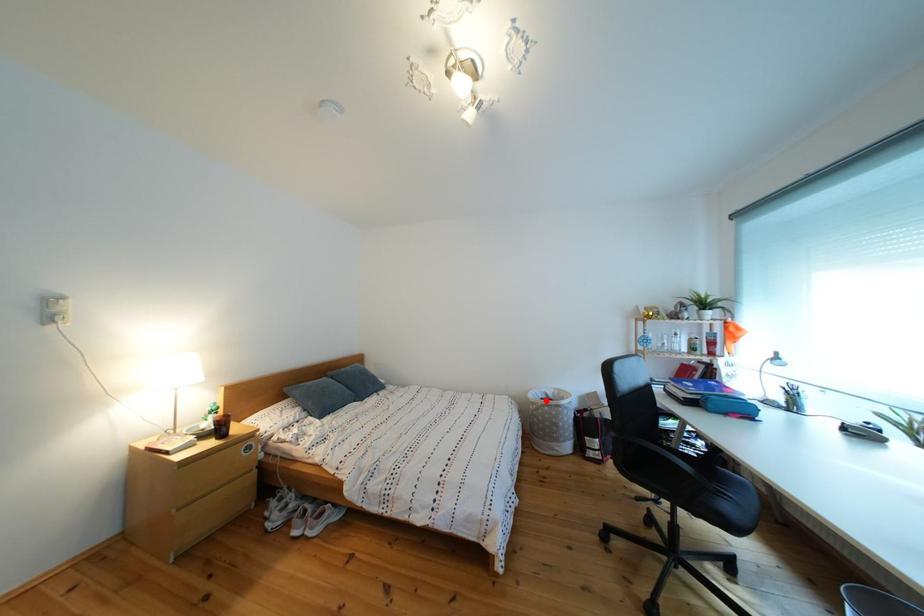
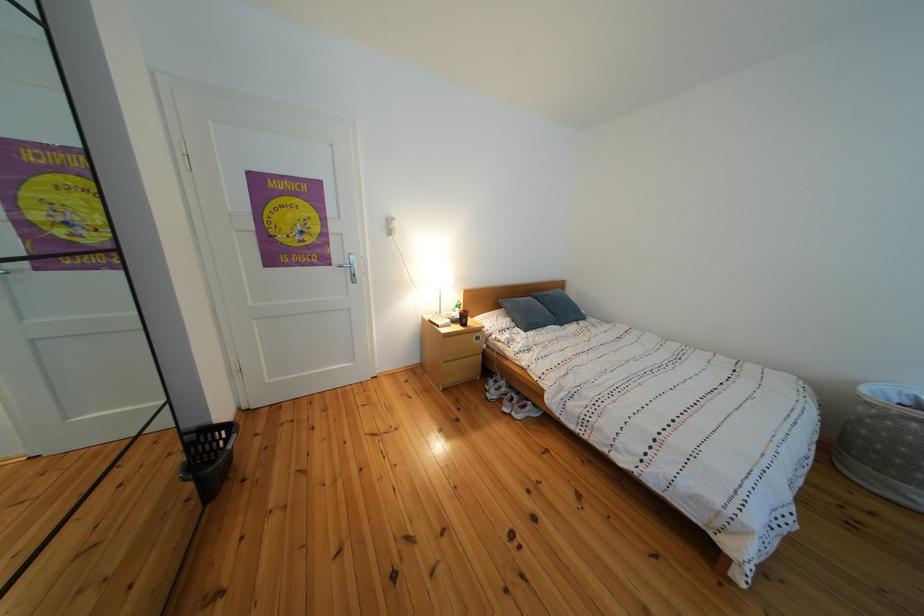
Find the pixel in the second image that matches the highlighted location in the first image.

(890, 398)